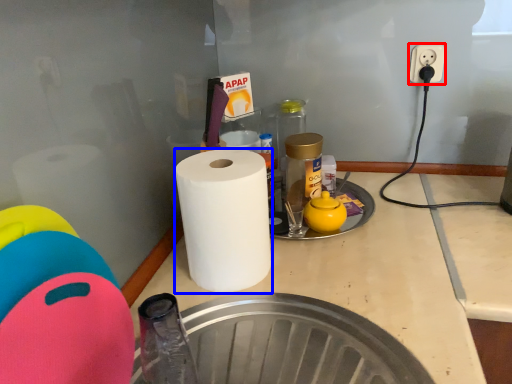
Question: Which of the following is the closest to the observer, electric outlet (highlighted by a red box) or paper towel (highlighted by a blue box)?

Choices:
 (A) electric outlet
 (B) paper towel

Answer: (B)